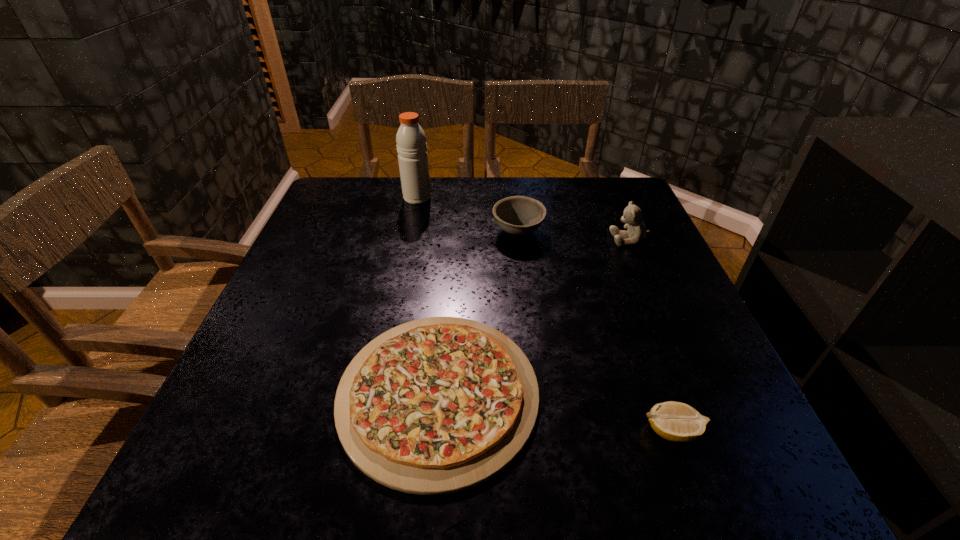
Image resolution: width=960 pixels, height=540 pixels. Find the location of `free space located 0.110m on the left of the third tallest object`. free space located 0.110m on the left of the third tallest object is located at coordinates (449, 232).

At what (x,y) coordinates should I click in order to perform the action: click on free location located 0.150m on the left of the fourth tallest object. Please return your answer as a coordinate pair (x, y). This screenshot has width=960, height=540. Looking at the image, I should click on (551, 431).

In order to click on vacant space situated 0.200m on the right of the pizza in this screenshot , I will do `click(652, 394)`.

Find the location of `shaker situated at the far edge`. shaker situated at the far edge is located at coordinates (411, 145).

The width and height of the screenshot is (960, 540). Identify the location of bowl situated at the far edge. (517, 215).

Identify the location of lemon that is positioned at the near edge. Image resolution: width=960 pixels, height=540 pixels. (675, 421).

You are a GUI agent. You are given a task and a screenshot of the screen. Output one action in this format:
    pyautogui.click(x=<x>, y=<y>)
    Task: Click on the pizza that is at the near edge
    
    Given the screenshot: What is the action you would take?
    point(435,406)

The height and width of the screenshot is (540, 960). I want to click on teddy bear at the right edge, so click(x=632, y=216).

Where is `lemon located at the right edge`? lemon located at the right edge is located at coordinates (675, 421).

Locate an element on the screen. This screenshot has height=540, width=960. object at the near right corner is located at coordinates (675, 421).